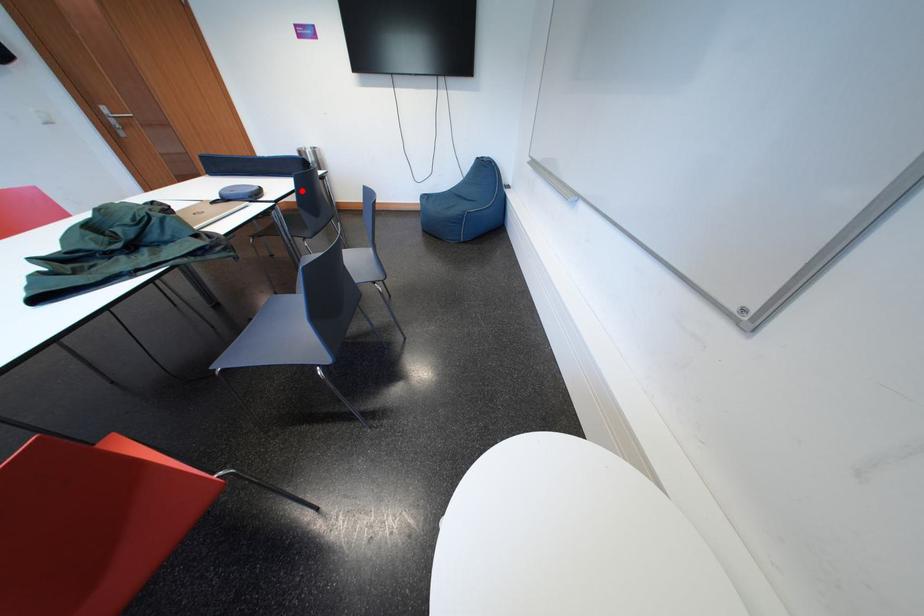
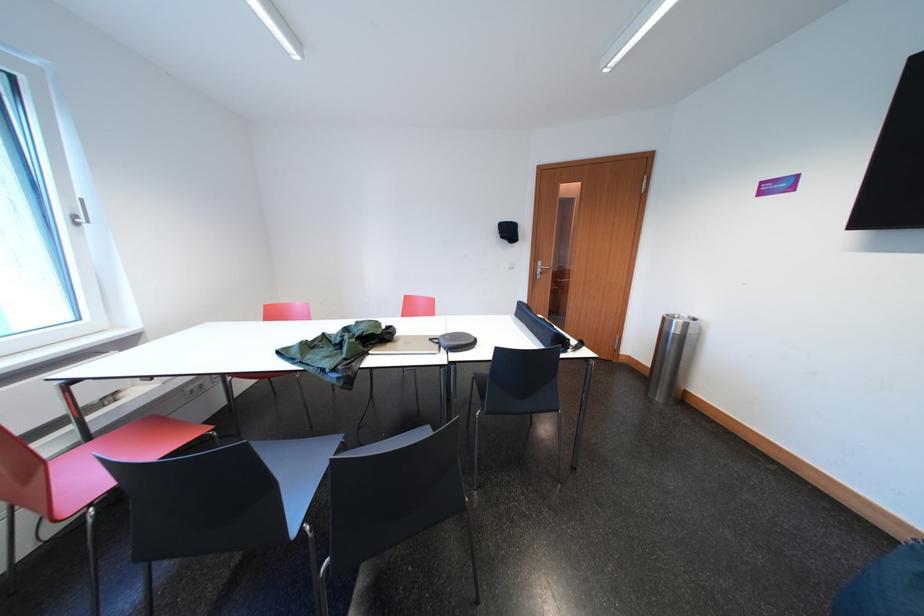
Question: I am providing you with two images of the same scene from different viewpoints. A red point is shown in image1. For the corresponding object point in image2, is it positioned nearer or farther from the camera?

Choices:
 (A) Nearer
 (B) Farther

Answer: (B)